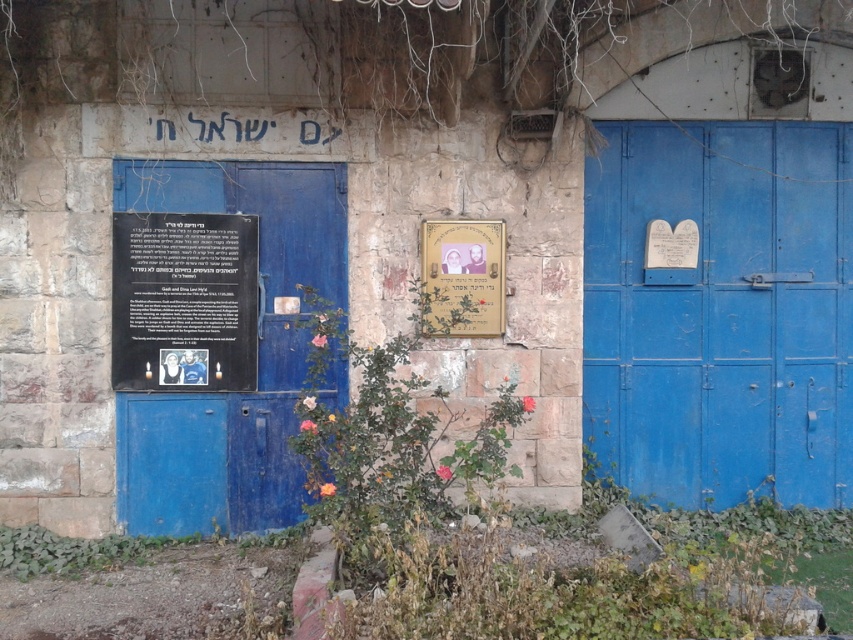
You are standing in front of an old stone wall with two blue doors. You notice a blue matte door at center and a green leafy plant at center. Which object is higher up on the wall?

The blue matte door at center is positioned over the green leafy plant at center, so the blue matte door at center is higher up on the wall.

Looking at this image, you are standing in front of the two blue doors on the aged stone wall. You notice two points marked on the doors. Which point is closer to you, the point at coordinates point (637, 404) or the point at coordinates point (440, 278)?

The point at coordinates point (440, 278) is closer to you because it is less further to the camera than point (637, 404).

You are a gardener who needs to water the green leafy plant at center and the black matte signboard at left. Which object requires more water because it is larger?

The green leafy plant at center requires more water because it is bigger than the black matte signboard at left.